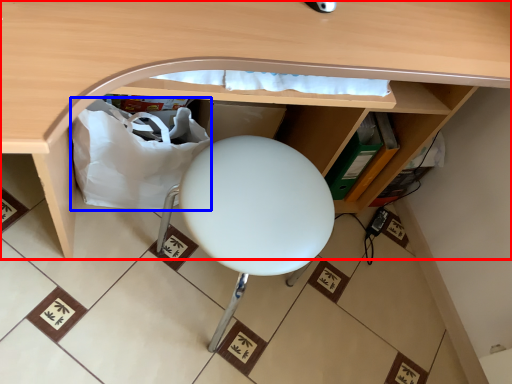
Question: Which object appears closest to the camera in this image, desk (highlighted by a red box) or paper bag (highlighted by a blue box)?

Choices:
 (A) desk
 (B) paper bag

Answer: (A)